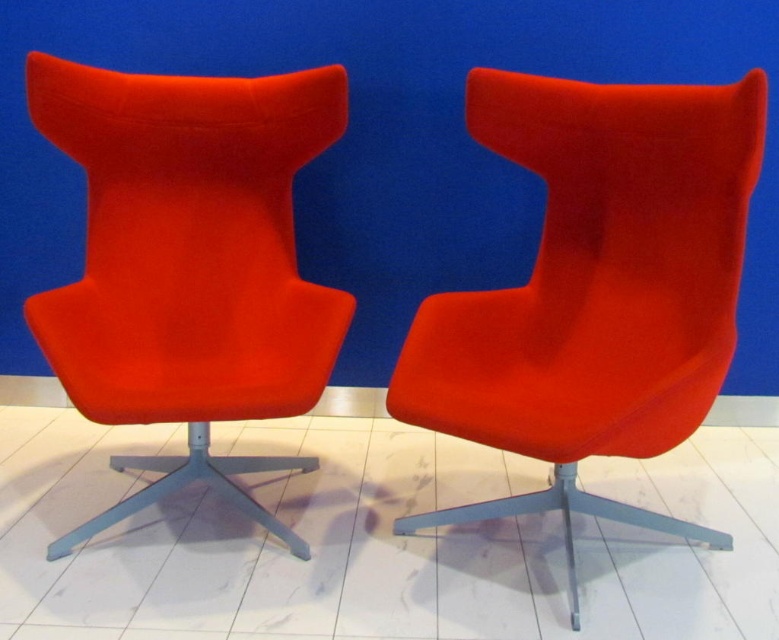
Question: Among these objects, which one is farthest from the camera?

Choices:
 (A) matte red fabric swivel chair at left
 (B) matte red armchair at center

Answer: (A)

Question: Which point is farther from the camera taking this photo?

Choices:
 (A) (608, 454)
 (B) (214, 204)

Answer: (B)

Question: Can you confirm if matte red armchair at center is positioned to the left of matte red fabric swivel chair at left?

Choices:
 (A) no
 (B) yes

Answer: (A)

Question: Which point is closer to the camera taking this photo?

Choices:
 (A) (732, 333)
 (B) (122, 285)

Answer: (A)

Question: Is matte red armchair at center below matte red fabric swivel chair at left?

Choices:
 (A) no
 (B) yes

Answer: (B)

Question: Is matte red armchair at center closer to camera compared to matte red fabric swivel chair at left?

Choices:
 (A) no
 (B) yes

Answer: (B)